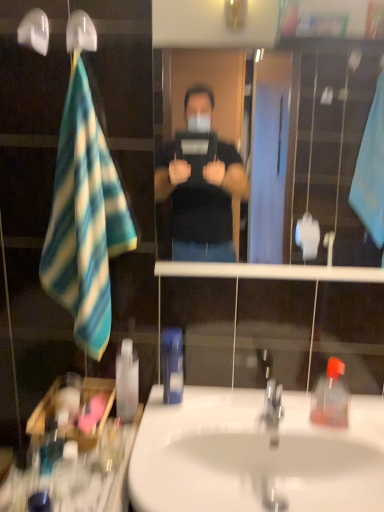
I want to click on empty space that is to the right of blue plastic mouthwash at center, the third mouthwash from the left, so click(218, 408).